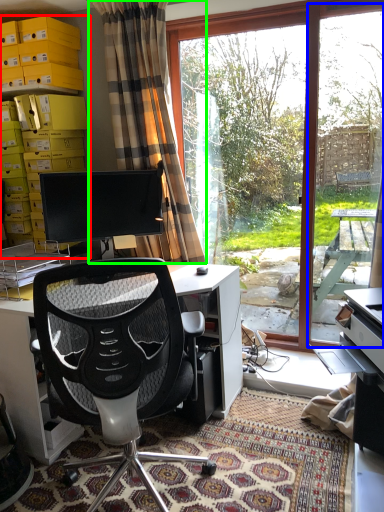
Question: Considering the real-world distances, which object is farthest from shelf (highlighted by a red box)? screen door (highlighted by a blue box) or curtain (highlighted by a green box)?

Choices:
 (A) screen door
 (B) curtain

Answer: (A)